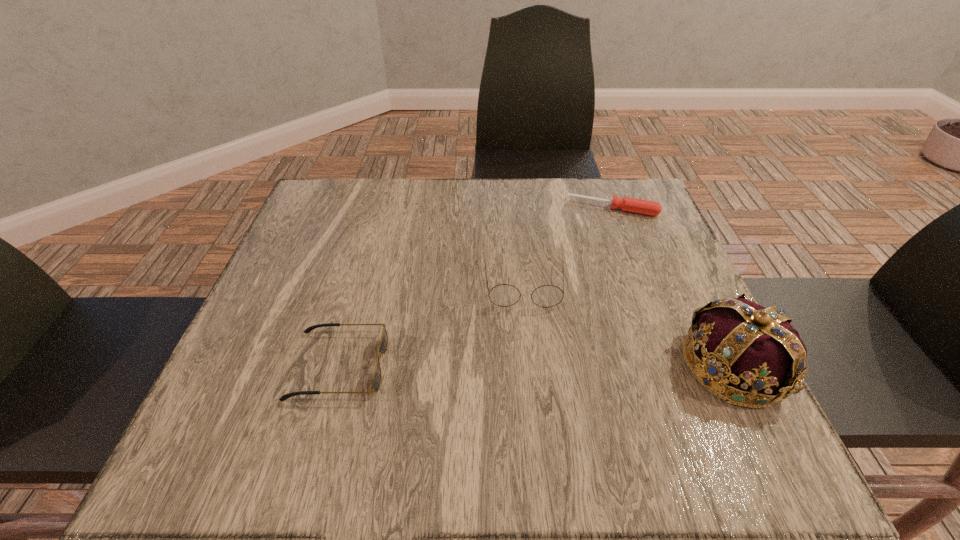
This screenshot has width=960, height=540. In order to click on free location at the near right corner in this screenshot , I will do `click(684, 411)`.

The width and height of the screenshot is (960, 540). I want to click on empty space that is in between the screwdriver and the second tallest object, so click(568, 246).

At what (x,y) coordinates should I click in order to perform the action: click on free spot between the third shortest object and the farthest object. Please return your answer as a coordinate pair (x, y). The image size is (960, 540). Looking at the image, I should click on (568, 246).

Locate an element on the screen. The image size is (960, 540). free space between the third tallest object and the farthest object is located at coordinates (475, 287).

Find the location of a particular element. The width and height of the screenshot is (960, 540). vacant area that lies between the farthest object and the crown is located at coordinates (673, 287).

Image resolution: width=960 pixels, height=540 pixels. In order to click on free space between the sunglasses and the second object from left to right in this screenshot , I will do click(x=431, y=324).

This screenshot has height=540, width=960. In order to click on vacant space that is in between the spectacles and the screwdriver in this screenshot , I will do `click(568, 246)`.

This screenshot has height=540, width=960. Identify the location of free space between the screwdriver and the tallest object. (673, 287).

Where is `free space between the second object from left to right and the leftmost object`? The height and width of the screenshot is (540, 960). free space between the second object from left to right and the leftmost object is located at coordinates (431, 324).

Locate an element on the screen. This screenshot has width=960, height=540. free space between the leftmost object and the second tallest object is located at coordinates (431, 324).